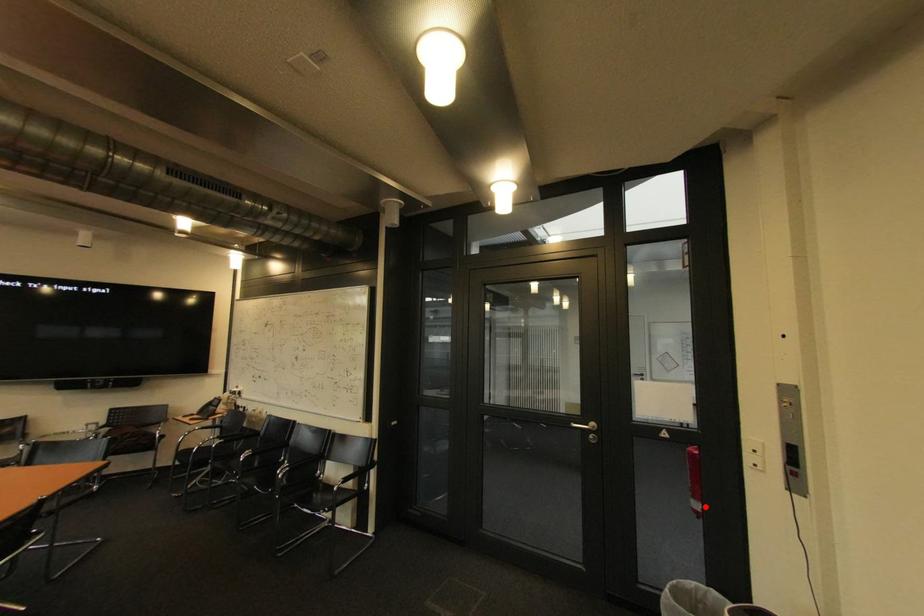
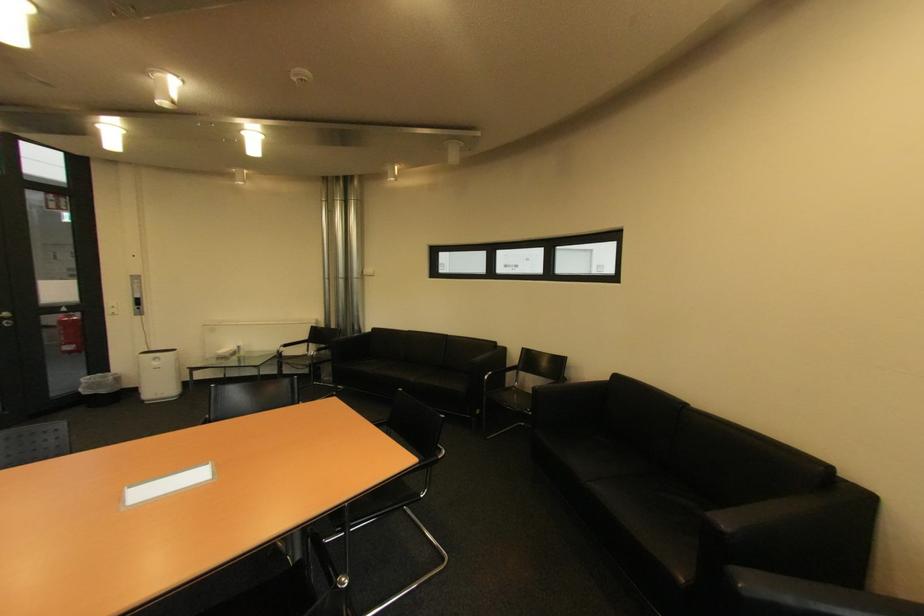
Question: I am providing you with two images of the same scene from different viewpoints. Image1 has a red point marked. In image2, the corresponding 3D location appears at what relative position? Reply with the corresponding letter.

Choices:
 (A) Closer
 (B) Farther

Answer: (A)